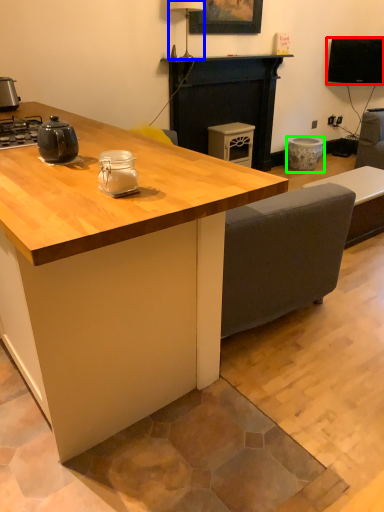
Question: Estimate the real-world distances between objects in this image. Which object is farther from television (highlighted by a red box), lamp (highlighted by a blue box) or appliance (highlighted by a green box)?

Choices:
 (A) lamp
 (B) appliance

Answer: (A)